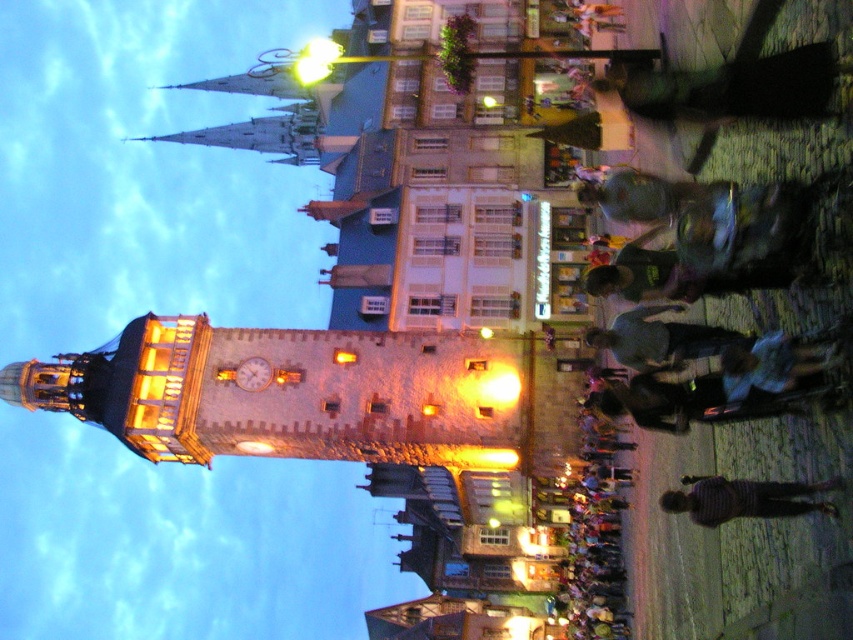
Question: Does dark green t-shirt at center have a greater width compared to dark gray shirt at center?

Choices:
 (A) no
 (B) yes

Answer: (B)

Question: Which of the following is the farthest from the observer?

Choices:
 (A) (781, 282)
 (B) (265, 364)

Answer: (B)

Question: Which is nearer to the striped sweater at lower right?

Choices:
 (A) dark gray shirt at center
 (B) dark green t-shirt at center

Answer: (A)

Question: Is dark green t-shirt at center below gold metallic clock at center?

Choices:
 (A) no
 (B) yes

Answer: (A)

Question: Which point is closer to the camera?

Choices:
 (A) (264, 387)
 (B) (798, 275)

Answer: (B)

Question: Is dark gray fabric bag at upper right below dark gray shirt at center?

Choices:
 (A) no
 (B) yes

Answer: (A)